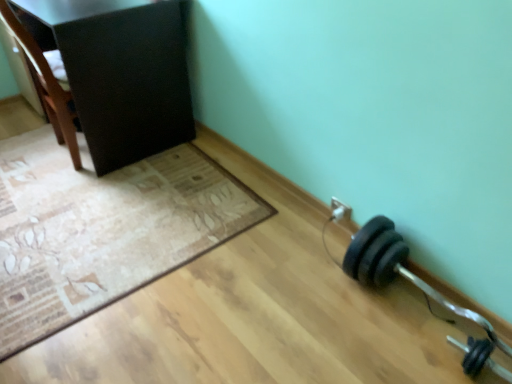
Locate an element on the screen. The height and width of the screenshot is (384, 512). free spot below brown wood chair at upper left (from a real-world perspective) is located at coordinates (59, 159).